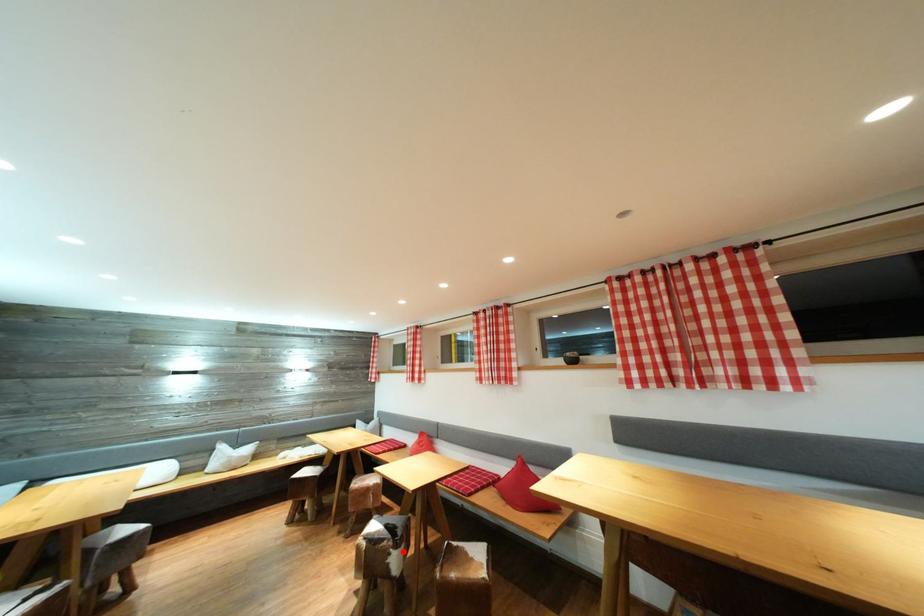
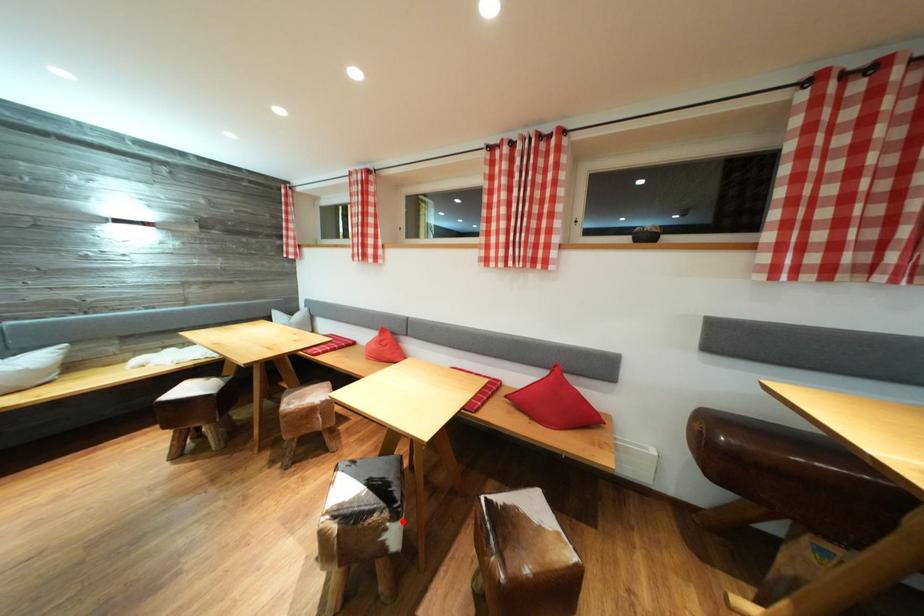
I am providing you with two images of the same scene from different viewpoints. A red point is marked on the first image and another point is marked on the second image. Is the marked point in image1 the same physical position as the marked point in image2?

Yes